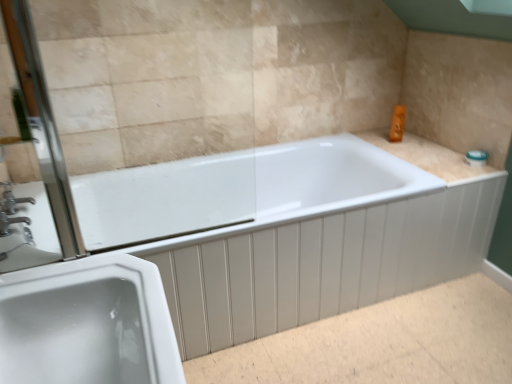
Question: From a real-world perspective, is white glossy sink at lower left above or below clear glass screen door at left?

Choices:
 (A) above
 (B) below

Answer: (B)

Question: In terms of size, does white glossy sink at lower left appear bigger or smaller than clear glass screen door at left?

Choices:
 (A) small
 (B) big

Answer: (B)

Question: Which of these objects is positioned farthest from the white glossy bathtub at center?

Choices:
 (A) white glossy sink at lower left
 (B) clear glass screen door at left
 (C) beige tile counter top at upper right
 (D) silver metallic faucet at left

Answer: (D)

Question: Estimate the real-world distances between objects in this image. Which object is closer to the white glossy bathtub at center?

Choices:
 (A) white glossy sink at lower left
 (B) silver metallic faucet at left
 (C) clear glass screen door at left
 (D) beige tile counter top at upper right

Answer: (D)